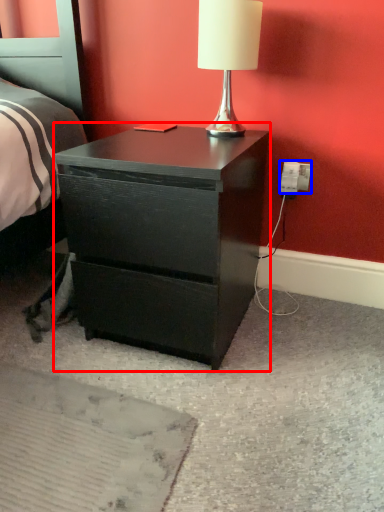
Question: Among these objects, which one is nearest to the camera, nightstand (highlighted by a red box) or electric outlet (highlighted by a blue box)?

Choices:
 (A) nightstand
 (B) electric outlet

Answer: (A)